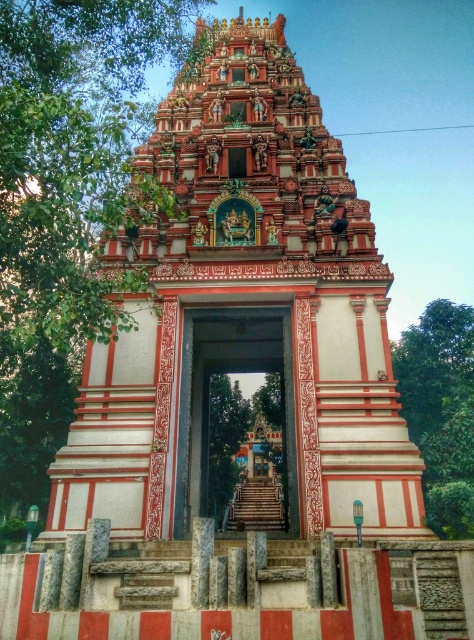
Can you confirm if polished stone temple at center is positioned to the left of polished stone gate at center?

Indeed, polished stone temple at center is positioned on the left side of polished stone gate at center.

Measure the distance from polished stone temple at center to polished stone gate at center.

The distance of polished stone temple at center from polished stone gate at center is 13.37 meters.

Who is more forward, (334, 356) or (282, 403)?

Positioned in front is point (334, 356).

Identify the location of polished stone temple at center. The image size is (474, 640). (244, 314).